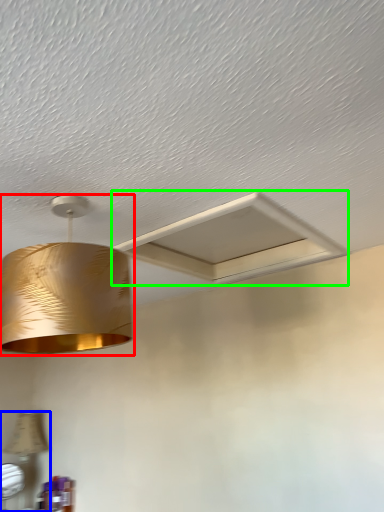
Question: Based on their relative distances, which object is nearer to lamp (highlighted by a red box)? Choose from lamp (highlighted by a blue box) and exhaust hood (highlighted by a green box).

Choices:
 (A) lamp
 (B) exhaust hood

Answer: (B)